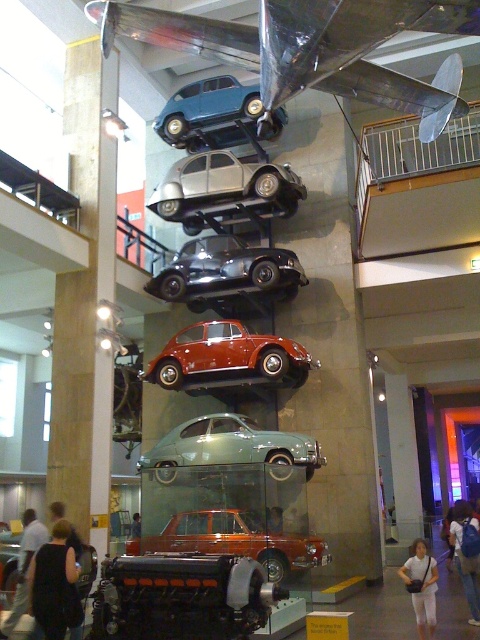
You are an art curator planning to install a new sculpture in the museum. The sculpture requires a clear space of 10 meters between the matte green car at center and the nearest wall. Is the current setup sufficient?

The distance between the matte green car at center and the nearest wall is 10.46 meters, which exceeds the required 10 meters. Therefore, the current setup provides sufficient space for the sculpture.

Based on the photo, you are an art curator planning to add a new sculpture to the museum. You have a small sculpture that is the same size as the smooth brown leather jacket at center. Will the silver metallic car at center block the view of the jacket when placed in the same central area?

The silver metallic car at center is bigger than the smooth brown leather jacket at center, so it will likely block the view of the jacket when placed in the same central area.